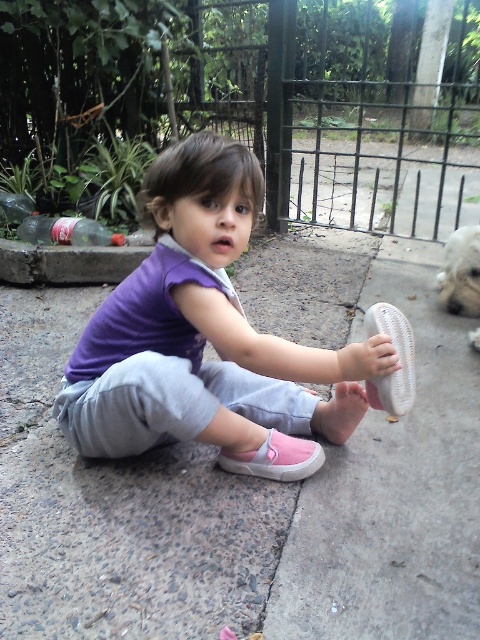
Question: Estimate the real-world distances between objects in this image. Which object is farther from the white fluffy dog at right?

Choices:
 (A) gray concrete pavement at center
 (B) pink fabric shoe at center

Answer: (B)

Question: Which object is positioned closest to the pink fabric shoe at center?

Choices:
 (A) gray concrete pavement at center
 (B) white fluffy dog at right

Answer: (A)

Question: Can you confirm if gray concrete pavement at center is wider than white fluffy dog at right?

Choices:
 (A) yes
 (B) no

Answer: (A)

Question: Does gray concrete pavement at center appear over pink fabric shoe at center?

Choices:
 (A) no
 (B) yes

Answer: (A)

Question: Is gray concrete pavement at center bigger than white fluffy dog at right?

Choices:
 (A) yes
 (B) no

Answer: (A)

Question: Which point is closer to the camera taking this photo?

Choices:
 (A) (3, 561)
 (B) (105, 384)

Answer: (A)